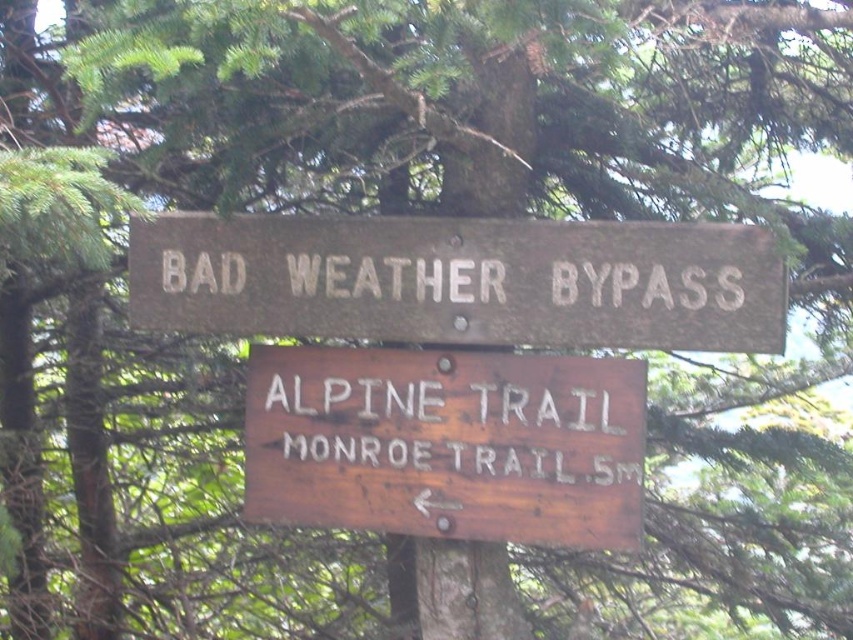
Is weathered wood sign at upper center wider than weathered wood sign at center?

Indeed, weathered wood sign at upper center has a greater width compared to weathered wood sign at center.

Which is behind, point (442, 312) or point (537, 428)?

Positioned behind is point (442, 312).

Is point (480, 310) behind point (277, 392)?

No, (480, 310) is closer to viewer.

You are a GUI agent. You are given a task and a screenshot of the screen. Output one action in this format:
    pyautogui.click(x=<x>, y=<y>)
    Task: Click on the weathered wood sign at upper center
    This screenshot has height=640, width=853.
    Given the screenshot: What is the action you would take?
    pyautogui.click(x=461, y=280)